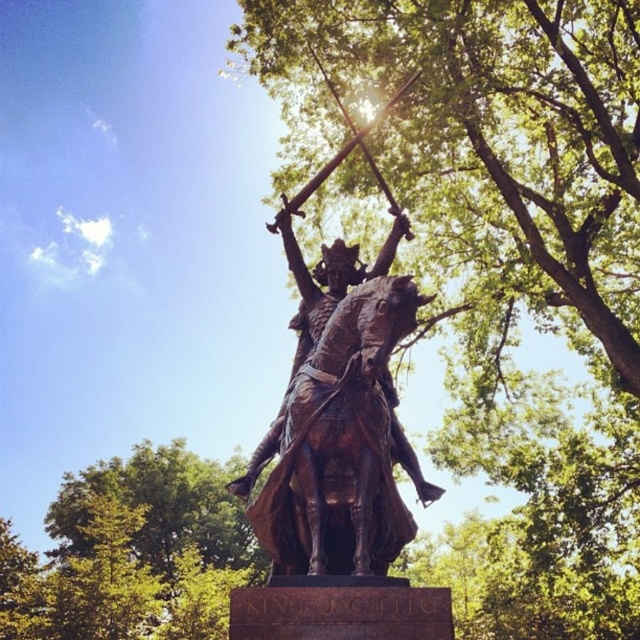
Between point (472, 256) and point (317, 432), which one is positioned behind?

Point (472, 256)

Is green leafy tree at upper center above bronze statue at center?

Incorrect, green leafy tree at upper center is not positioned above bronze statue at center.

Find the location of a particular element. The width and height of the screenshot is (640, 640). green leafy tree at upper center is located at coordinates (502, 241).